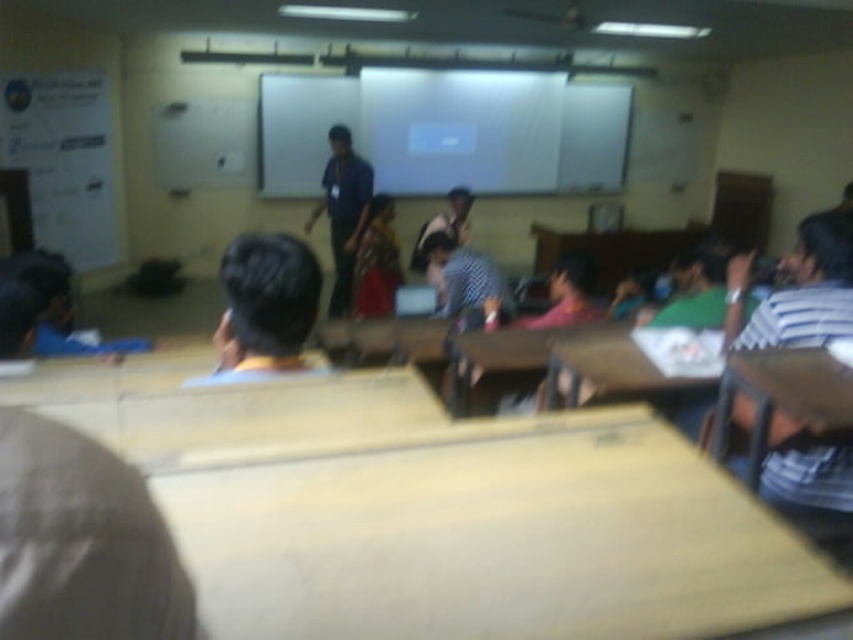
You are a student sitting at the back of the classroom. You notice two people in front of you wearing a white striped shirt at right and a checkered fabric shirt at center. Which person is closer to you?

The white striped shirt at right is shorter than the checkered fabric shirt at center, so the person wearing the white striped shirt at right is closer to you.

You are a photographer standing at the back of the classroom. You want to capture a photo of both the blue shirt at center and the checkered fabric shirt at center without any overlap. Given that your camera has a fixed focal length, which shirt should you focus on to ensure both are in frame?

The blue shirt at center is wider than the checkered fabric shirt at center, so focusing on the blue shirt at center will ensure both are in frame as it occupies more space.

You are a student sitting at the back row of the classroom. You want to see the whiteboard at the front clearly. Which student in the front row is blocking your view more, the blue shirt at center or the checkered fabric shirt at center?

The blue shirt at center is much taller than the checkered fabric shirt at center, so the blue shirt at center is blocking your view more.